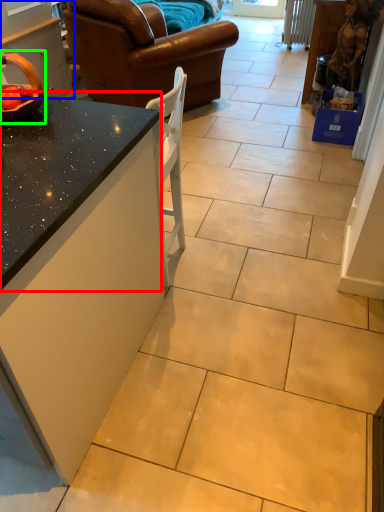
Question: Which object is positioned closest to countertop (highlighted by a red box)? Select from cabinetry (highlighted by a blue box) and appliance (highlighted by a green box).

Choices:
 (A) cabinetry
 (B) appliance

Answer: (B)